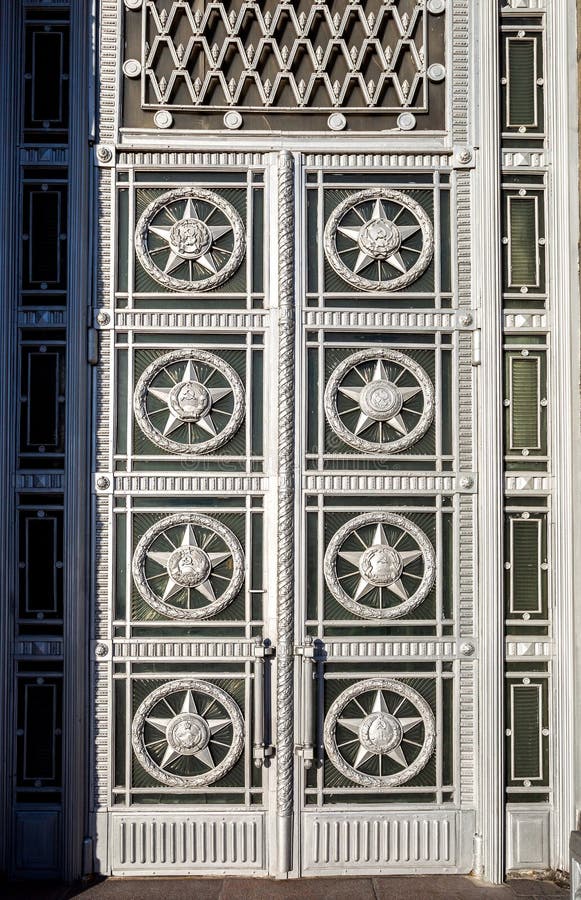
Identify the location of right door. (346, 817).